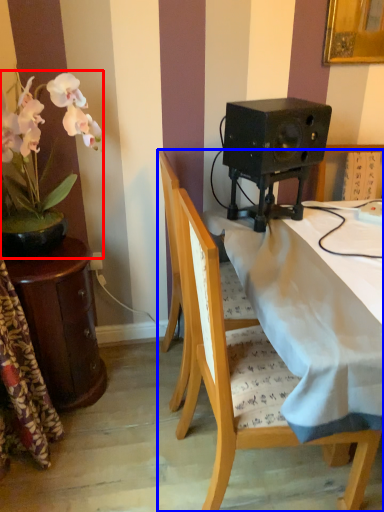
Question: Among these objects, which one is nearest to the camera, houseplant (highlighted by a red box) or chair (highlighted by a blue box)?

Choices:
 (A) houseplant
 (B) chair

Answer: (B)